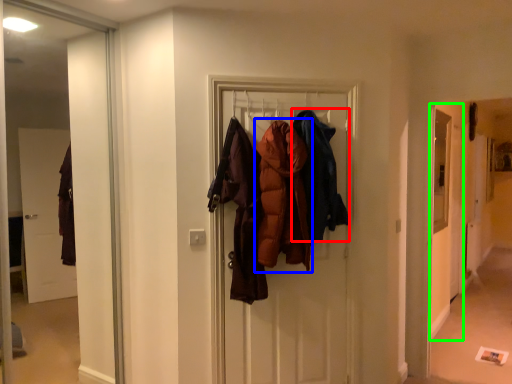
Question: Which object is positioned closest to garment (highlighted by a red box)? Select from garment (highlighted by a blue box) and screen door (highlighted by a green box).

Choices:
 (A) garment
 (B) screen door

Answer: (A)